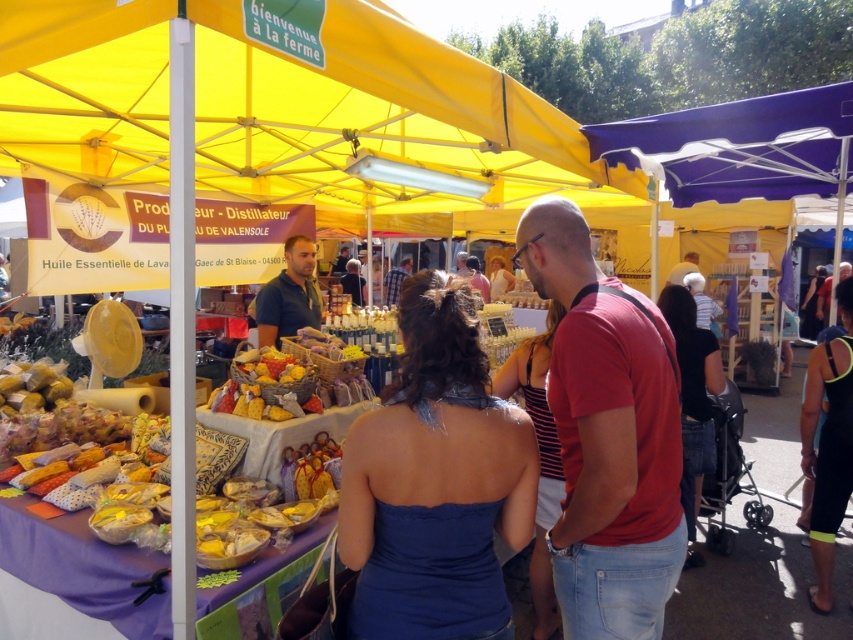
You are a customer at the market and want to pick up both the black denim jeans at lower right and the matte white shirt at center. Which item should you reach for first to avoid blocking the other?

You should reach for the black denim jeans at lower right first because it is in front of the matte white shirt at center, so picking it up first will prevent blocking access to the shirt.